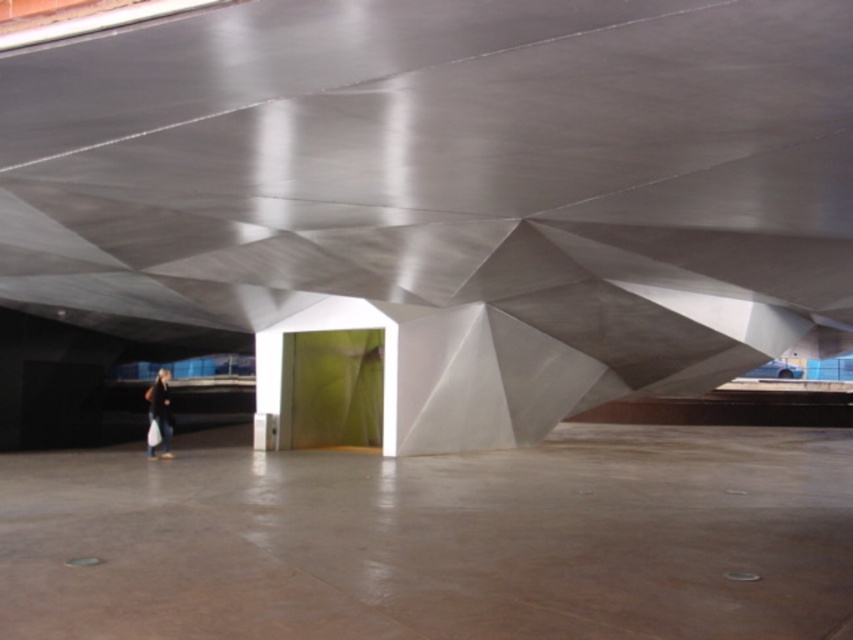
Question: In this image, where is metallic silver structure at center located relative to dark blue jeans at lower left?

Choices:
 (A) above
 (B) below

Answer: (A)

Question: Which point is farther from the camera taking this photo?

Choices:
 (A) (315, 625)
 (B) (320, 147)
 (C) (149, 408)

Answer: (C)

Question: Which point is closer to the camera?

Choices:
 (A) (160, 432)
 (B) (424, 218)

Answer: (B)

Question: Is the position of metallic silver structure at center more distant than that of smooth concrete floor at center?

Choices:
 (A) no
 (B) yes

Answer: (A)

Question: Which point is closer to the camera taking this photo?

Choices:
 (A) (70, 500)
 (B) (154, 396)

Answer: (A)

Question: From the image, what is the correct spatial relationship of smooth concrete floor at center in relation to dark blue jeans at lower left?

Choices:
 (A) below
 (B) above

Answer: (A)